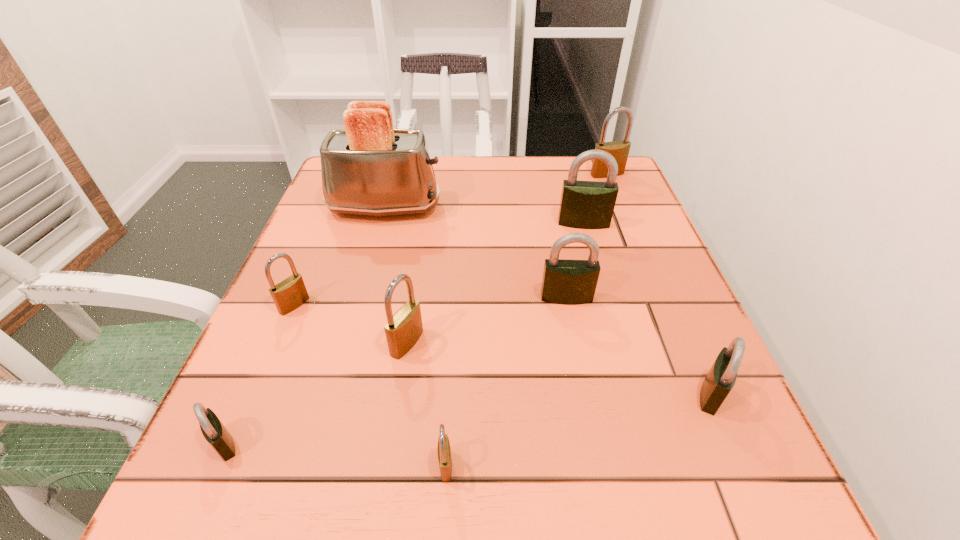
This screenshot has height=540, width=960. In order to click on the tallest object in this screenshot , I will do `click(369, 168)`.

I want to click on toaster, so click(x=369, y=168).

You are a GUI agent. You are given a task and a screenshot of the screen. Output one action in this format:
    pyautogui.click(x=<x>, y=<y>)
    Task: Click on the second farthest padlock
    This screenshot has height=540, width=960.
    Given the screenshot: What is the action you would take?
    pyautogui.click(x=584, y=204)

Find the location of a particular element. the farthest black padlock is located at coordinates (584, 204).

Locate an element on the screen. The width and height of the screenshot is (960, 540). the biggest brass padlock is located at coordinates 619,150.

I want to click on the rightmost brass padlock, so click(x=619, y=150).

This screenshot has height=540, width=960. I want to click on the second farthest black padlock, so (567, 282).

This screenshot has width=960, height=540. In order to click on the sixth padlock from right to left in this screenshot , I will do (x=403, y=329).

Locate an element on the screen. the second nearest brass padlock is located at coordinates (403, 329).

I want to click on the leftmost brass padlock, so click(289, 294).